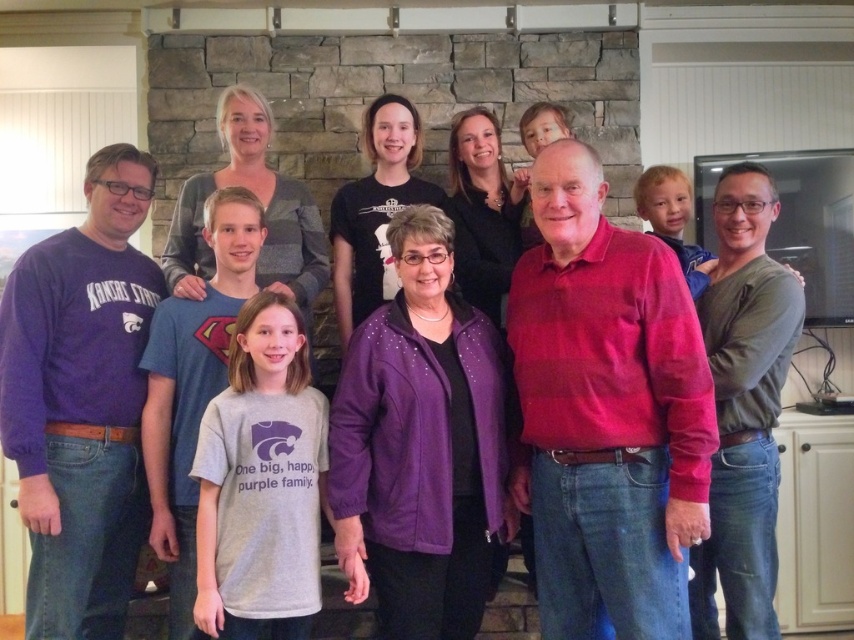
Does matte red sweater at center have a smaller size compared to green matte shirt at upper right?

No, matte red sweater at center is not smaller than green matte shirt at upper right.

Does point (568, 406) lie in front of point (724, 337)?

Yes, it is.

The image size is (854, 640). I want to click on matte red sweater at center, so click(x=607, y=410).

This screenshot has width=854, height=640. I want to click on matte red sweater at center, so point(607,410).

Does matte red sweater at center appear on the right side of purple fabric jacket at center?

Indeed, matte red sweater at center is positioned on the right side of purple fabric jacket at center.

The width and height of the screenshot is (854, 640). Describe the element at coordinates (607, 410) in the screenshot. I see `matte red sweater at center` at that location.

Where is `matte red sweater at center`? Image resolution: width=854 pixels, height=640 pixels. matte red sweater at center is located at coordinates (607, 410).

Does purple fabric jacket at center appear under green matte shirt at upper right?

Yes.

Can you confirm if purple fabric jacket at center is positioned to the right of green matte shirt at upper right?

Incorrect, purple fabric jacket at center is not on the right side of green matte shirt at upper right.

Where is `purple fabric jacket at center`? The image size is (854, 640). purple fabric jacket at center is located at coordinates (423, 442).

The width and height of the screenshot is (854, 640). What are the coordinates of `purple fabric jacket at center` in the screenshot? It's located at (423, 442).